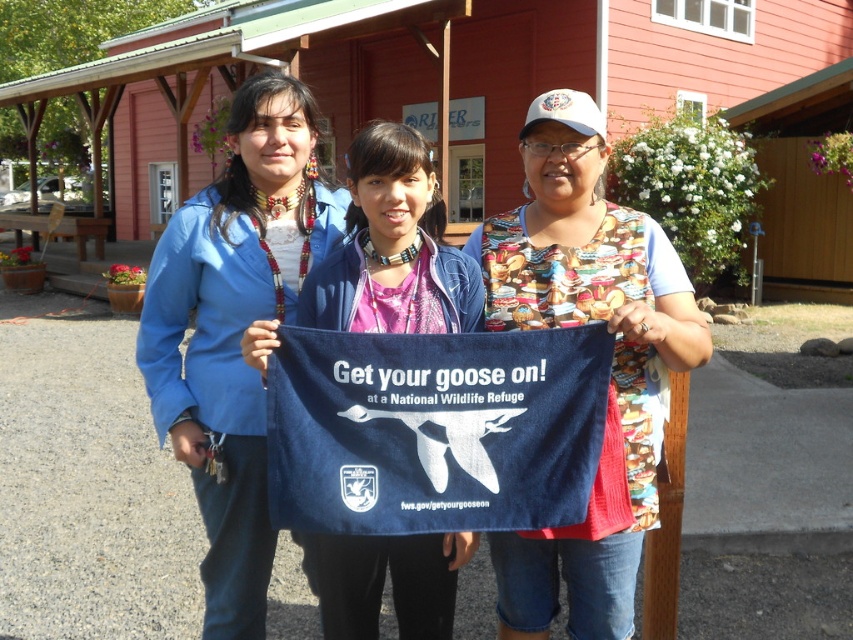
You are standing at the camera position and want to reach the point marked at point (282,216). Can you walk directly to it in one step?

The distance between you and point (282,216) is 2.68 meters, so you would need to take multiple steps to reach it as one step is typically about 0.76 meters.

You are organizing an outdoor event and need to decide which item to hang from a hook that can only support items shorter than 30 cm. You have a printed fabric apron at center and a blue fabric bag at center. Which item is suitable for the hook?

The printed fabric apron at center is shorter than the blue fabric bag at center, so it is suitable for the hook since it is under 30 cm.

You are a visitor at the RIVER building and see both the printed fabric apron at center and the blue fabric bag at center. Which item is closer to the ground?

The printed fabric apron at center is located below the blue fabric bag at center, so it is closer to the ground.